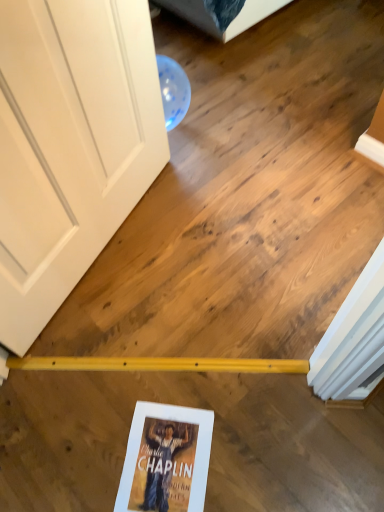
The width and height of the screenshot is (384, 512). Identify the location of free space in front of white matte door at upper left. (125, 360).